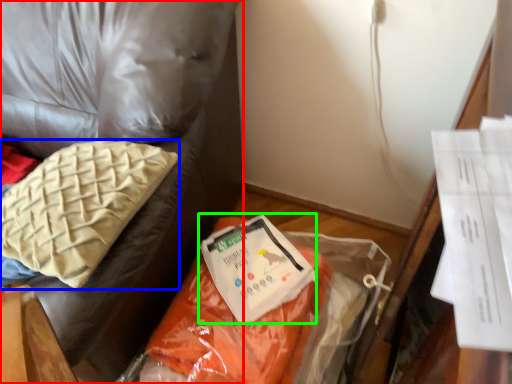
Question: Estimate the real-world distances between objects in this image. Which object is farther from furniture (highlighted by a red box), pillow (highlighted by a blue box) or wrap (highlighted by a green box)?

Choices:
 (A) pillow
 (B) wrap

Answer: (B)